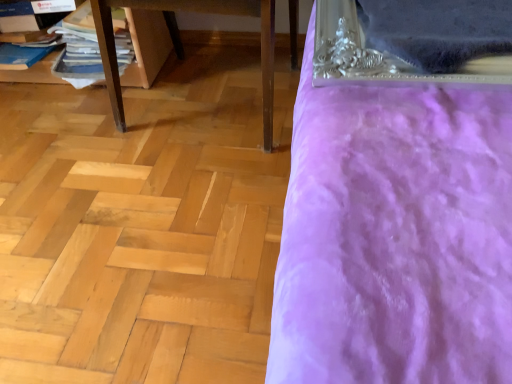
Describe the element at coordinates (182, 44) in the screenshot. The image size is (512, 384). I see `wooden table at center` at that location.

Locate an element on the screen. The image size is (512, 384). wooden table at center is located at coordinates (182, 44).

Image resolution: width=512 pixels, height=384 pixels. What are the coordinates of `wooden table at center` in the screenshot? It's located at 182,44.